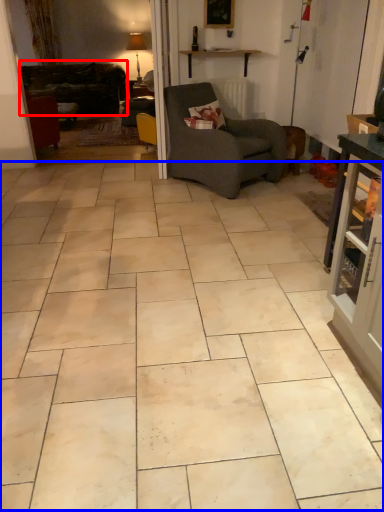
Question: Among these objects, which one is nearest to the camera, studio couch (highlighted by a red box) or ceramic tile (highlighted by a blue box)?

Choices:
 (A) studio couch
 (B) ceramic tile

Answer: (B)